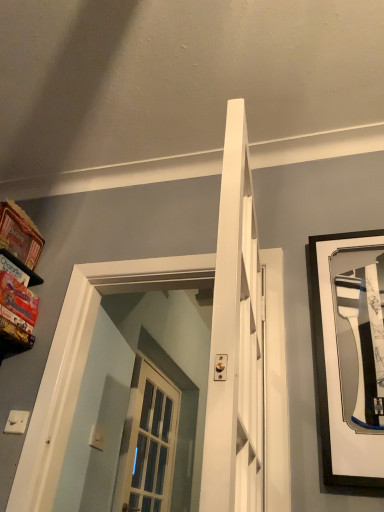
Question: Based on their sizes in the image, would you say matte cardboard shelf at left is bigger or smaller than black matte picture frame at right?

Choices:
 (A) big
 (B) small

Answer: (A)

Question: Is matte cardboard shelf at left in front of or behind black matte picture frame at right in the image?

Choices:
 (A) behind
 (B) front

Answer: (A)

Question: Which is nearer to the white plastic light switch at lower left?

Choices:
 (A) black matte picture frame at right
 (B) matte cardboard shelf at left

Answer: (B)

Question: Which of these objects is positioned farthest from the white plastic light switch at lower left?

Choices:
 (A) black matte picture frame at right
 (B) matte cardboard shelf at left

Answer: (A)